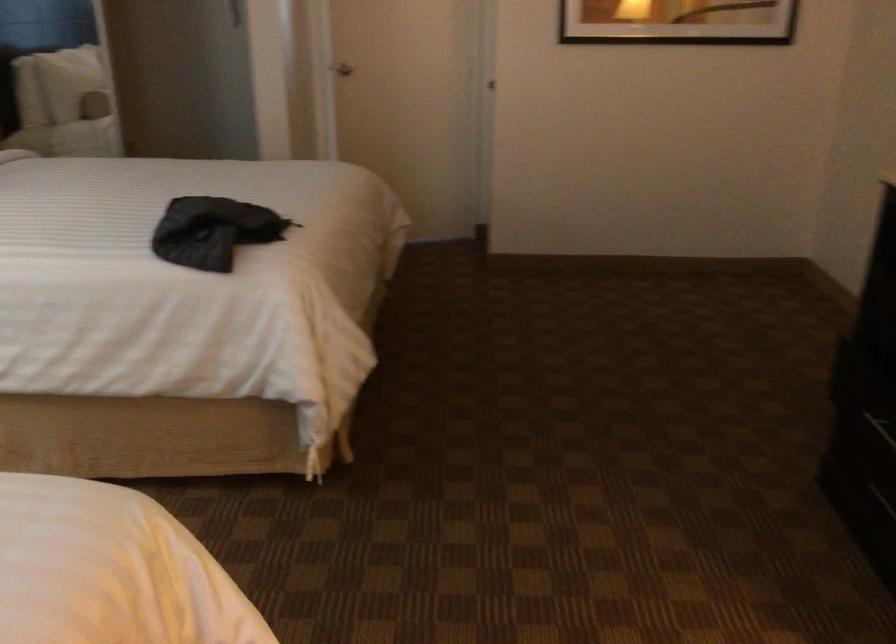
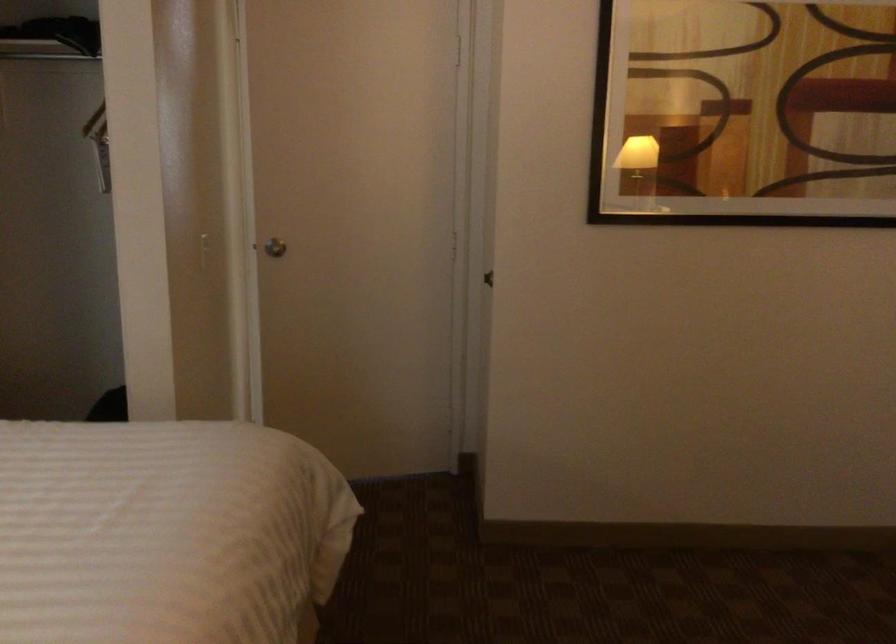
Question: What movement of the cameraman would produce the second image?

Choices:
 (A) Left
 (B) Right
 (C) Forward
 (D) Backward

Answer: (C)